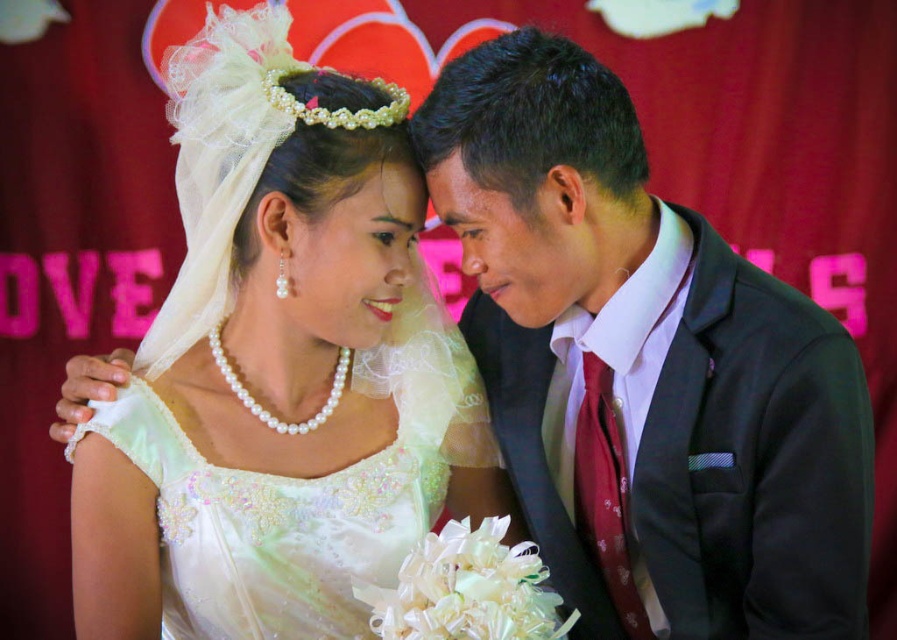
Which is above, white satin dress at center or satin black suit at right?

Positioned higher is white satin dress at center.

Who is shorter, white satin dress at center or satin black suit at right?

With less height is satin black suit at right.

Does point (399, 433) lie in front of point (675, 285)?

No, it is behind (675, 285).

Identify the location of white satin dress at center. Image resolution: width=897 pixels, height=640 pixels. (279, 369).